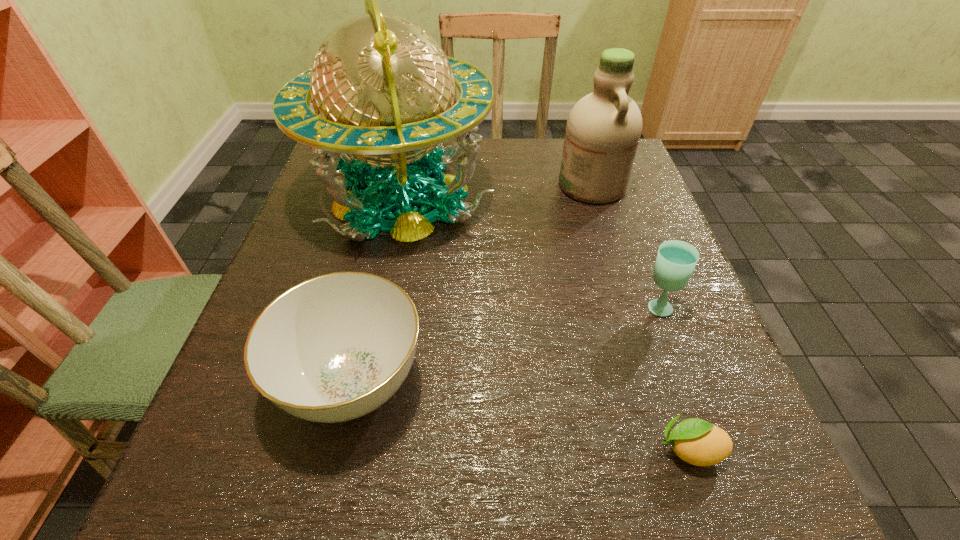
Identify the location of cleansing agent that is at the right edge. The image size is (960, 540). (603, 130).

I want to click on glass located in the right edge section of the desktop, so click(676, 260).

The width and height of the screenshot is (960, 540). Find the location of `lemon located in the right edge section of the desktop`. lemon located in the right edge section of the desktop is located at coordinates (698, 442).

This screenshot has height=540, width=960. What are the coordinates of `object positioned at the far left corner` in the screenshot? It's located at (383, 90).

Identify the location of object positioned at the near left corner. (333, 348).

Identify the location of object that is at the far right corner. The height and width of the screenshot is (540, 960). (603, 130).

The image size is (960, 540). Identify the location of object present at the near right corner. (698, 442).

In the image, there is a desktop. Find the location of `free space at the far edge`. free space at the far edge is located at coordinates (554, 164).

Where is `vacant space at the near edge`? The width and height of the screenshot is (960, 540). vacant space at the near edge is located at coordinates (355, 456).

Where is `free spot at the left edge of the desktop`? free spot at the left edge of the desktop is located at coordinates (244, 345).